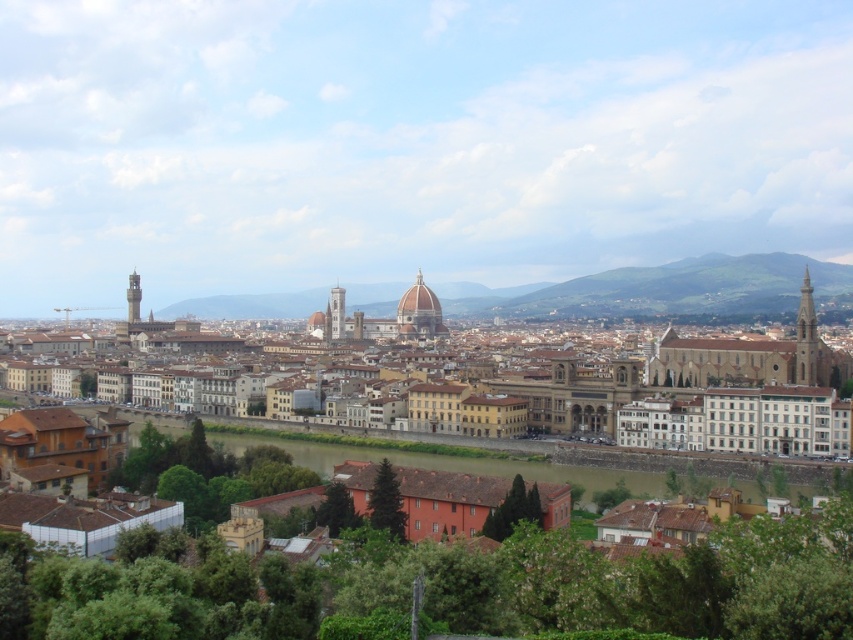
Who is more distant from viewer, (732,385) or (363,305)?

Positioned behind is point (363,305).

You are a GUI agent. You are given a task and a screenshot of the screen. Output one action in this format:
    pyautogui.click(x=<x>, y=<y>)
    Task: Click on the brown stone buildings at center
    
    Given the screenshot: What is the action you would take?
    pyautogui.click(x=706, y=388)

Who is more distant from viewer, (132, 276) or (479, 472)?

Positioned behind is point (132, 276).

Based on the photo, is brown stone buildings at center further to camera compared to brown earthy river at center?

Yes, it is behind brown earthy river at center.

Who is more distant from viewer, (712, 442) or (254, 435)?

Point (254, 435)

Find the location of a particular element. brown stone buildings at center is located at coordinates (706, 388).

Is brown stone hill at center below brown earthy river at center?

Incorrect, brown stone hill at center is not positioned below brown earthy river at center.

Between brown stone hill at center and brown earthy river at center, which one is positioned lower?

brown earthy river at center is below.

At what (x,y) coordinates should I click in order to perform the action: click on brown stone hill at center. Please return your answer as a coordinate pair (x, y). This screenshot has height=640, width=853. Looking at the image, I should click on (665, 289).